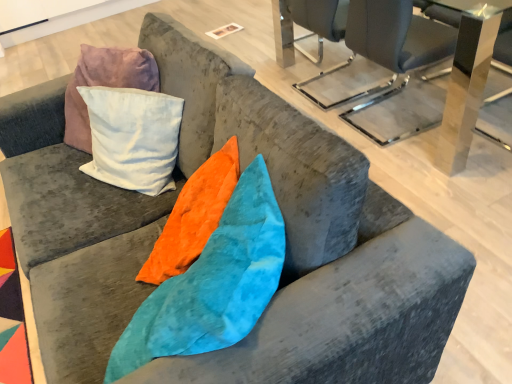
Question: Is transparent acrylic table at upper center, which is counted as the 2th table, starting from the back, bigger or smaller than metallic gray chair at upper right?

Choices:
 (A) big
 (B) small

Answer: (A)

Question: Visually, is transparent acrylic table at upper center, acting as the first table starting from the front, positioned to the left or to the right of metallic gray chair at upper right?

Choices:
 (A) left
 (B) right

Answer: (B)

Question: Which of these objects is positioned closest to the metallic glass table at upper right, placed as the 2th table when sorted from front to back?

Choices:
 (A) metallic gray chair at upper right
 (B) transparent acrylic table at upper center, which is counted as the 2th table, starting from the back

Answer: (B)

Question: Which object is the farthest from the metallic glass table at upper right, the first table in the back-to-front sequence?

Choices:
 (A) transparent acrylic table at upper center, acting as the first table starting from the front
 (B) metallic gray chair at upper right

Answer: (B)